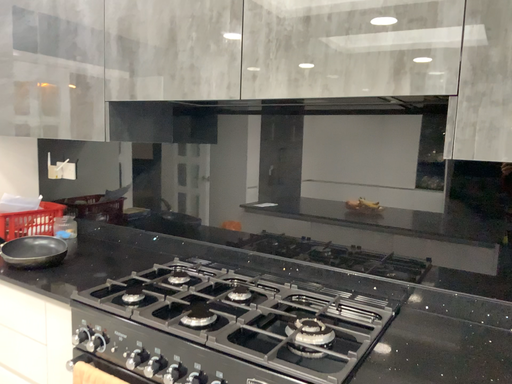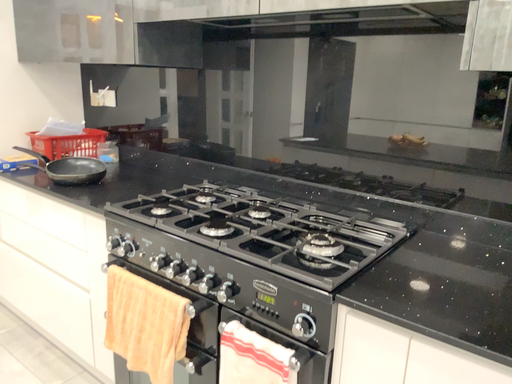
Question: How did the camera likely rotate when shooting the video?

Choices:
 (A) rotated left
 (B) rotated right

Answer: (A)